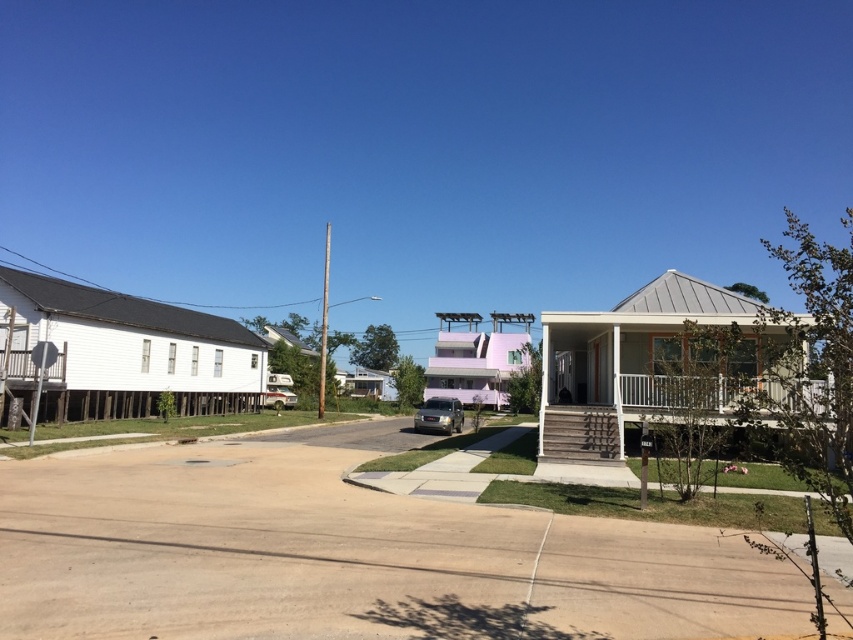
Is smooth concrete driveway at center closer to the viewer compared to metallic silver car at center?

Yes, smooth concrete driveway at center is closer to the viewer.

Looking at this image, does smooth concrete driveway at center have a greater width compared to metallic silver car at center?

Indeed, smooth concrete driveway at center has a greater width compared to metallic silver car at center.

Find the location of a particular element. This screenshot has height=640, width=853. smooth concrete driveway at center is located at coordinates (349, 556).

Where is `smooth concrete driveway at center`? The width and height of the screenshot is (853, 640). smooth concrete driveway at center is located at coordinates (349, 556).

Is smooth concrete driveway at center above satin gold suv at center?

Correct, smooth concrete driveway at center is located above satin gold suv at center.

Is smooth concrete driveway at center bigger than satin gold suv at center?

No, smooth concrete driveway at center is not bigger than satin gold suv at center.

Which is in front, point (502, 573) or point (434, 401)?

Positioned in front is point (502, 573).

You are a GUI agent. You are given a task and a screenshot of the screen. Output one action in this format:
    pyautogui.click(x=<x>, y=<y>)
    Task: Click on the smooth concrete driveway at center
    The image size is (853, 640).
    Given the screenshot: What is the action you would take?
    pyautogui.click(x=349, y=556)

Can you confirm if satin gold suv at center is positioned to the left of metallic silver car at center?

No, satin gold suv at center is not to the left of metallic silver car at center.

Is satin gold suv at center to the right of metallic silver car at center from the viewer's perspective?

Indeed, satin gold suv at center is positioned on the right side of metallic silver car at center.

Where is `satin gold suv at center`? Image resolution: width=853 pixels, height=640 pixels. satin gold suv at center is located at coordinates (439, 416).